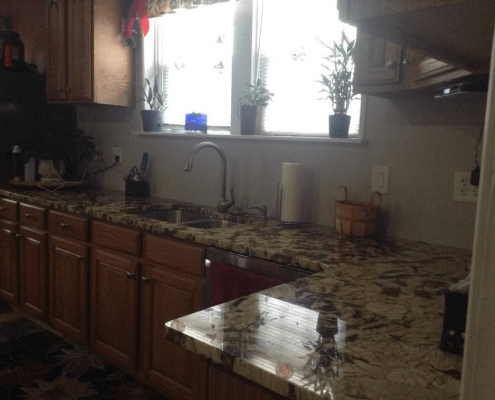
I want to click on sink, so click(183, 218).